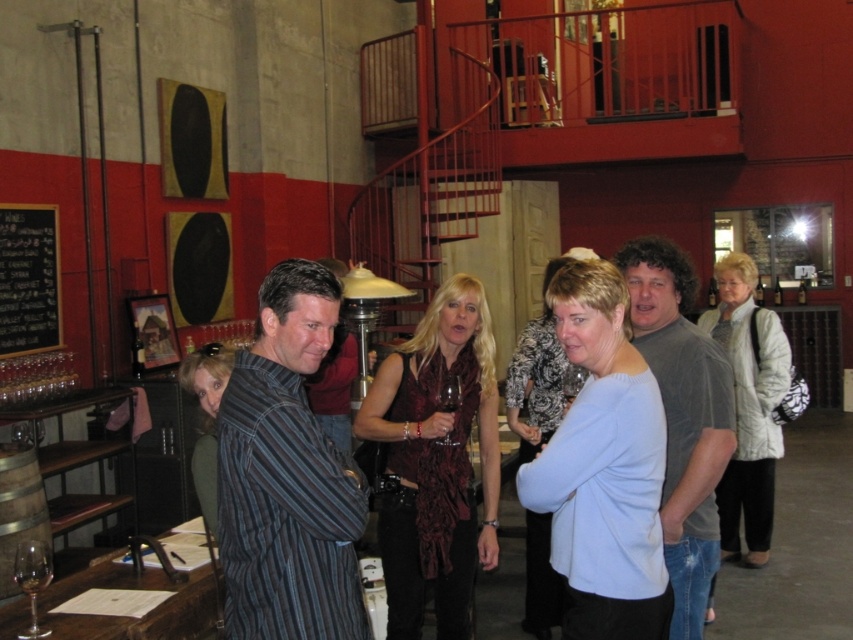
Between point (30, 604) and point (573, 368), which one is positioned behind?

The point (573, 368) is more distant.

Who is more forward, (45, 547) or (572, 365)?

Positioned in front is point (45, 547).

Which is behind, point (32, 582) or point (564, 410)?

The point (564, 410) is behind.

At what (x,y) coordinates should I click in order to perform the action: click on clear glass wine glass at lower left. Please return your answer as a coordinate pair (x, y). The width and height of the screenshot is (853, 640). Looking at the image, I should click on (32, 579).

Does gray cotton t-shirt at center lie behind transparent plastic wine glass at center?

No.

Who is positioned more to the right, gray cotton t-shirt at center or transparent plastic wine glass at center?

Positioned to the right is gray cotton t-shirt at center.

Describe the element at coordinates (682, 417) in the screenshot. The width and height of the screenshot is (853, 640). I see `gray cotton t-shirt at center` at that location.

This screenshot has height=640, width=853. Identify the location of gray cotton t-shirt at center. (682, 417).

Who is lower down, striped cotton shirt at center or transparent glass at center?

transparent glass at center is below.

Between point (325, 531) and point (451, 401), which one is positioned behind?

The point (451, 401) is behind.

This screenshot has width=853, height=640. Identify the location of striped cotton shirt at center. (287, 476).